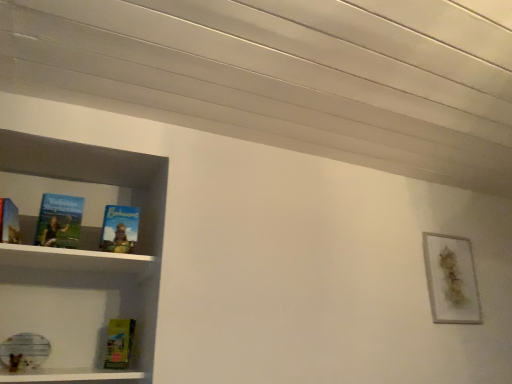
Question: From the image's perspective, is yellow matte paperback book at lower left located above or below gold textured frame at upper right?

Choices:
 (A) below
 (B) above

Answer: (A)

Question: Considering the positions of point (131, 331) and point (448, 236), is point (131, 331) closer or farther from the camera than point (448, 236)?

Choices:
 (A) farther
 (B) closer

Answer: (B)

Question: Which of these objects is positioned farthest from the blue matte book at center, the 2th book positioned from the left?

Choices:
 (A) yellow matte paperback book at lower left
 (B) matte blue book at left, which is the 1th book in left-to-right order
 (C) gold textured frame at upper right

Answer: (C)

Question: Based on their relative distances, which object is nearer to the blue matte book at center, the 2th book positioned from the left?

Choices:
 (A) matte blue book at left, positioned as the 2th book in right-to-left order
 (B) gold textured frame at upper right
 (C) yellow matte paperback book at lower left

Answer: (A)